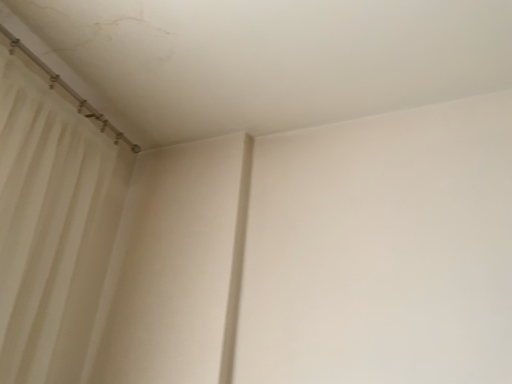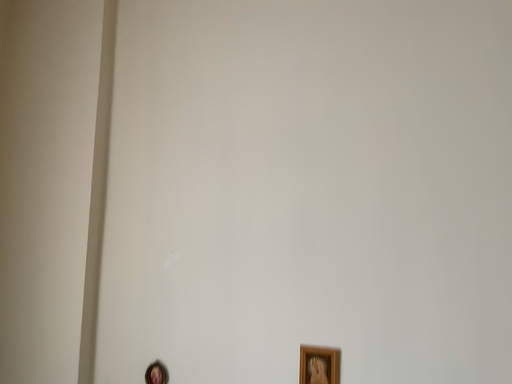
Question: How did the camera likely rotate when shooting the video?

Choices:
 (A) rotated downward
 (B) rotated upward

Answer: (A)